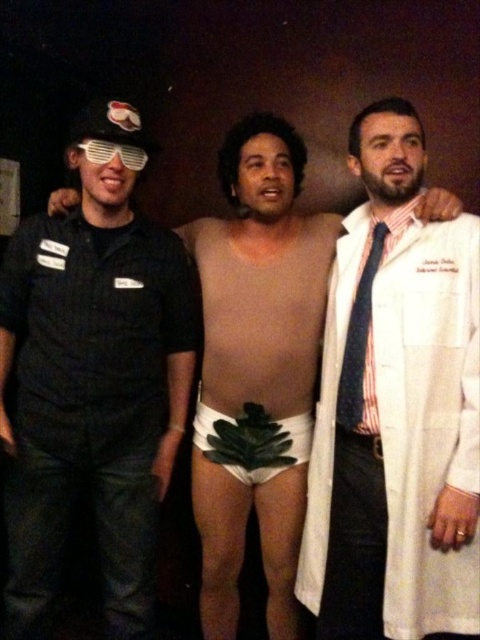
Does white lab coat at right have a greater height compared to blue striped tie at right?

Yes.

Is point (340, 262) in front of point (360, 289)?

No, (340, 262) is behind (360, 289).

Find the location of a particular element. The height and width of the screenshot is (640, 480). white lab coat at right is located at coordinates (315, 528).

I want to click on white lab coat at right, so click(315, 528).

Measure the distance from black matte uniform at left to blue striped tie at right.

They are 25.70 inches apart.

I want to click on black matte uniform at left, so click(93, 384).

Can you confirm if white lab coat at right is positioned to the left of white plastic goggles at left?

In fact, white lab coat at right is to the right of white plastic goggles at left.

Find the location of a particular element. The image size is (480, 640). white lab coat at right is located at coordinates (315, 528).

This screenshot has height=640, width=480. What do you see at coordinates (315, 528) in the screenshot?
I see `white lab coat at right` at bounding box center [315, 528].

Locate an element on the screen. The image size is (480, 640). white lab coat at right is located at coordinates (315, 528).